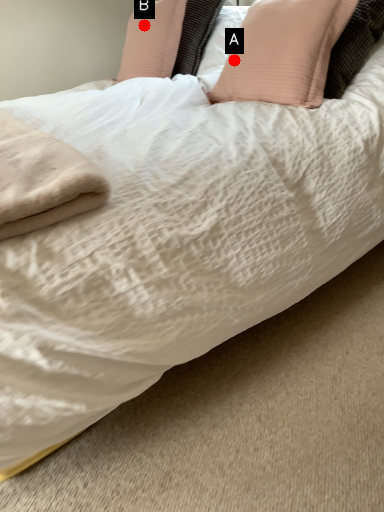
Question: Two points are circled on the image, labeled by A and B beside each circle. Which of the following is the farthest from the observer?

Choices:
 (A) A is further
 (B) B is further

Answer: (B)